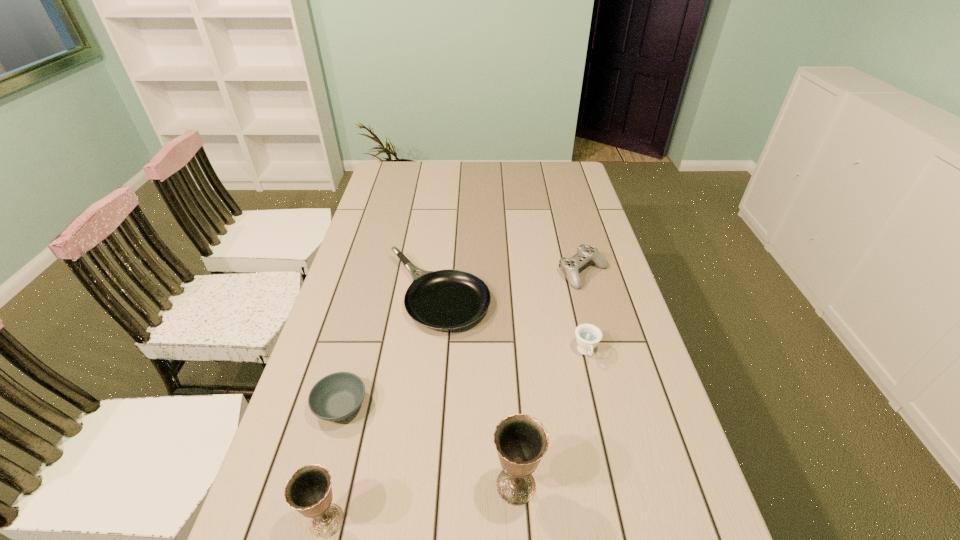
The chalices are evenly distributed in the image. To maintain this, where would you place another chalice on the right? Please point to a free space. Please provide its 2D coordinates. Your answer should be formatted as a tuple, i.e. [(x, y)], where the tuple contains the x and y coordinates of a point satisfying the conditions above.

[(684, 454)]